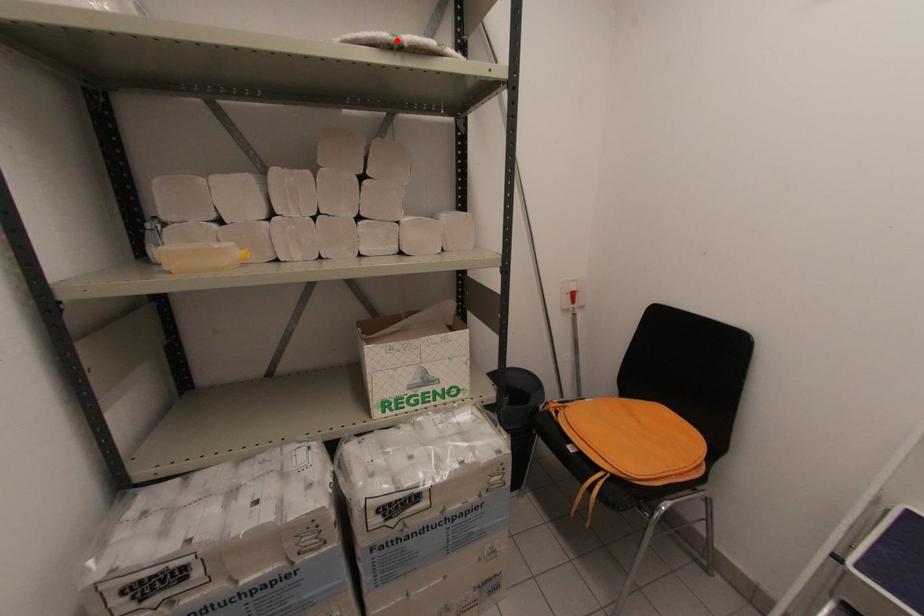
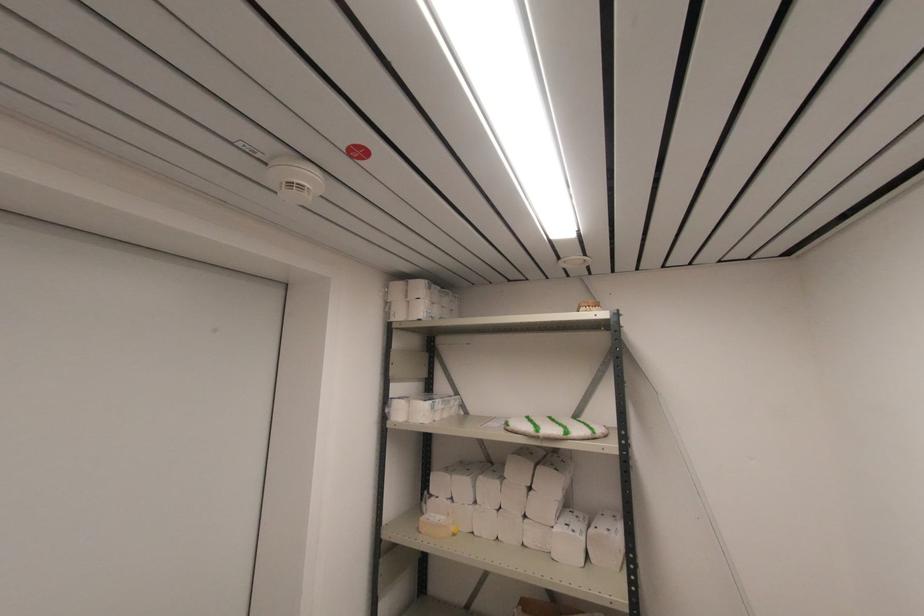
In the second image, find the point that corresponds to the highlighted location in the first image.

(537, 436)